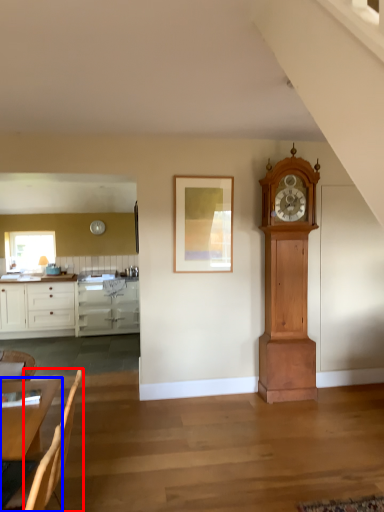
Question: Which point is further to the camera, armchair (highlighted by a red box) or table (highlighted by a blue box)?

Choices:
 (A) armchair
 (B) table

Answer: (A)